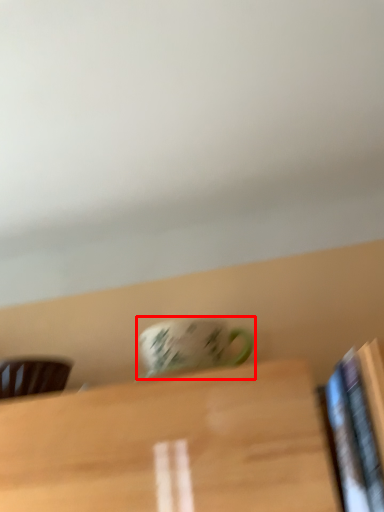
Question: From the image's perspective, where is coffee cup (annotated by the red box) located relative to chair?

Choices:
 (A) above
 (B) below

Answer: (A)